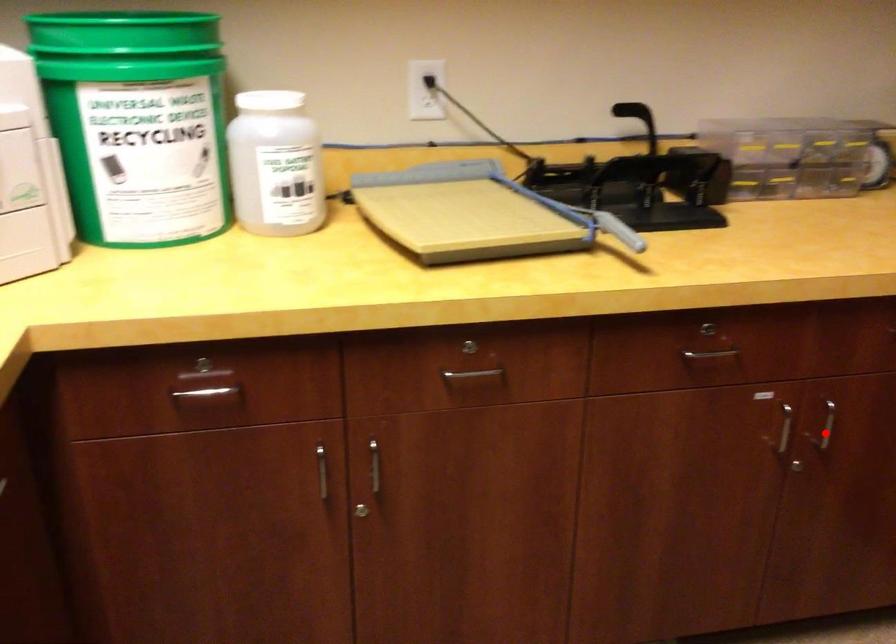
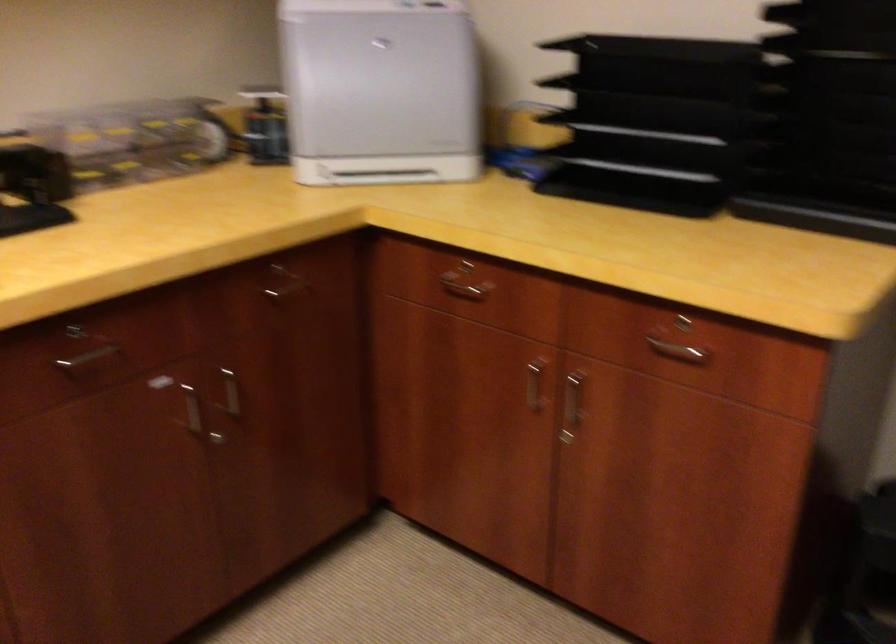
In the second image, find the point that corresponds to the highlighted location in the first image.

(234, 395)